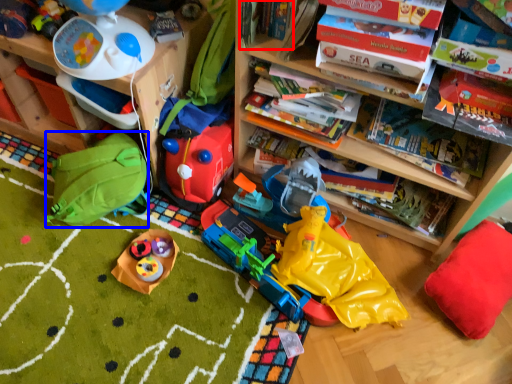
Question: Which object appears farthest to the camera in this image, book (highlighted by a red box) or backpack (highlighted by a blue box)?

Choices:
 (A) book
 (B) backpack

Answer: (B)